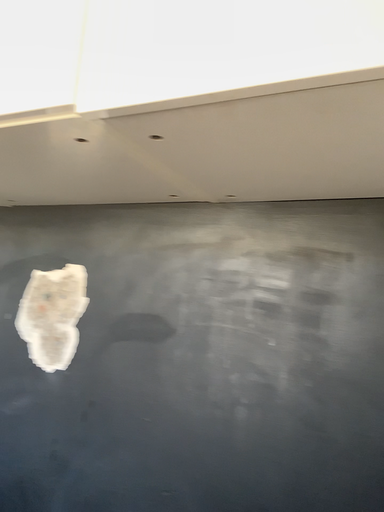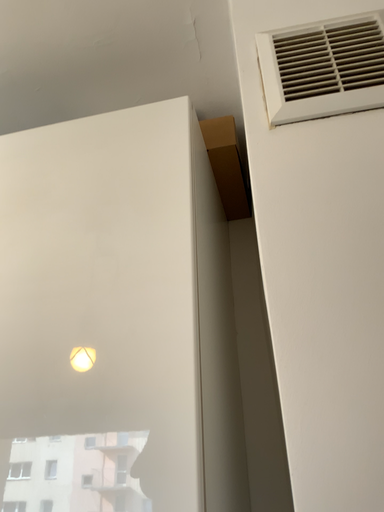
Question: How did the camera likely rotate when shooting the video?

Choices:
 (A) rotated downward
 (B) rotated upward

Answer: (B)